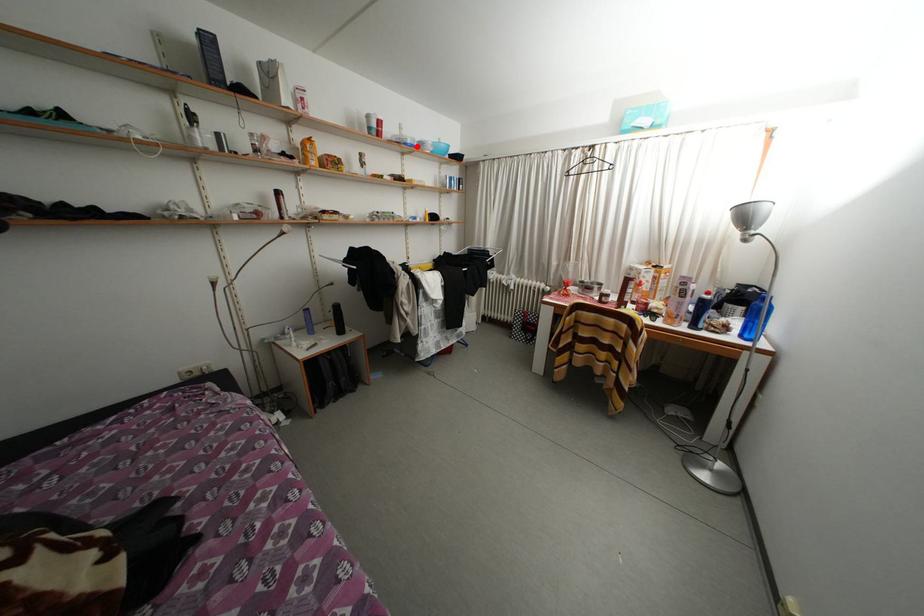
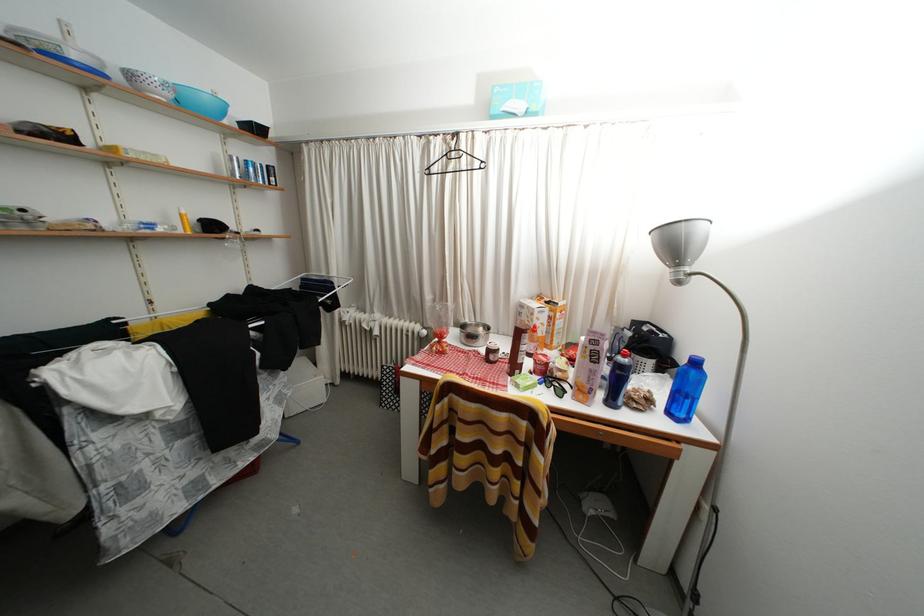
The point at the highlighted location is marked in the first image. Where is the corresponding point in the second image?

(81, 61)